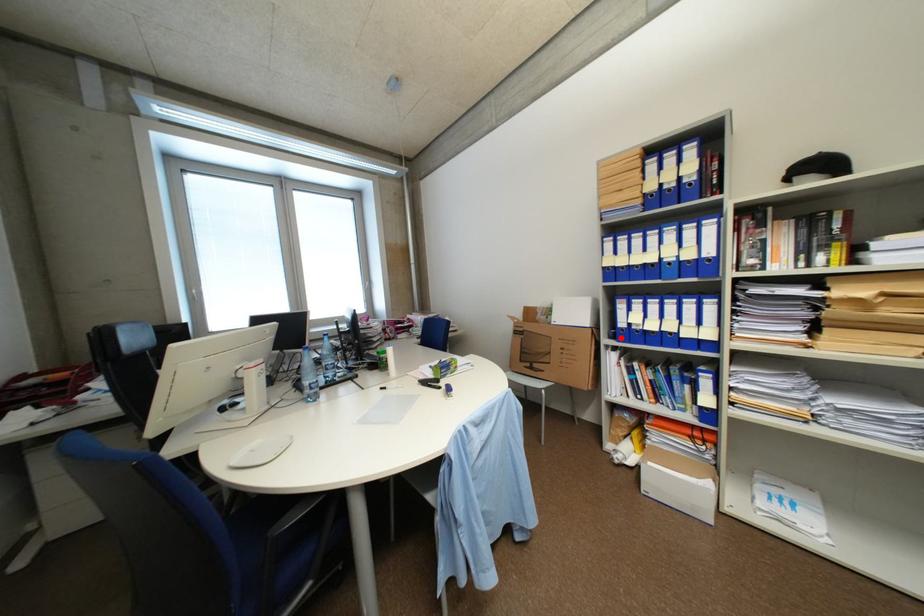
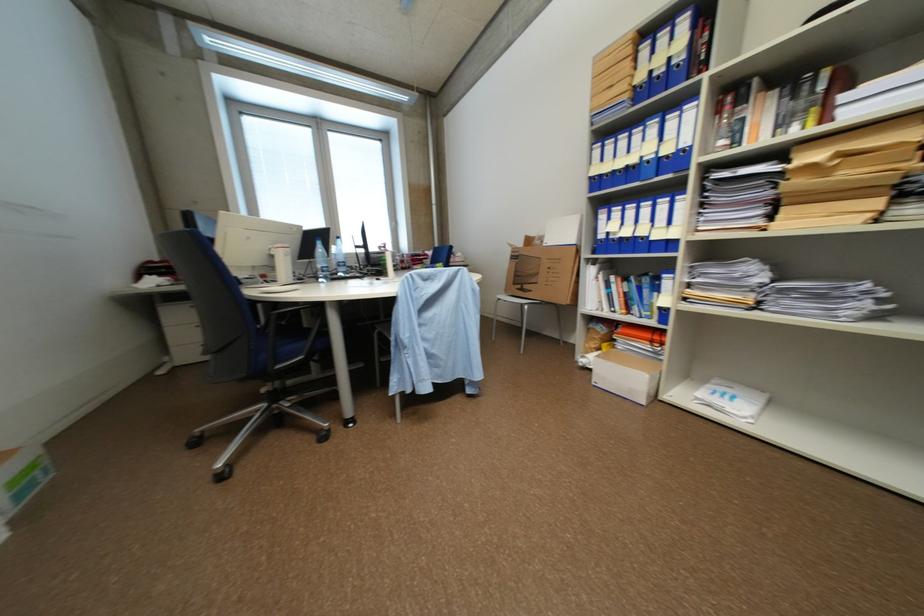
Find the pixel in the second image that matches the highlighted location in the first image.

(602, 253)